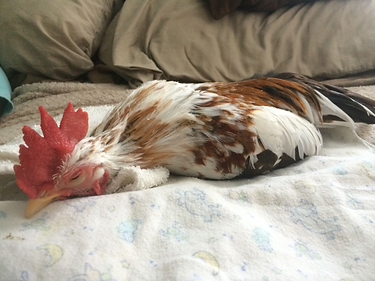
At what (x,y) coordinates should I click in order to perform the action: click on towel. Please return your answer as a coordinate pair (x, y). The image size is (375, 281). Looking at the image, I should click on (143, 176).